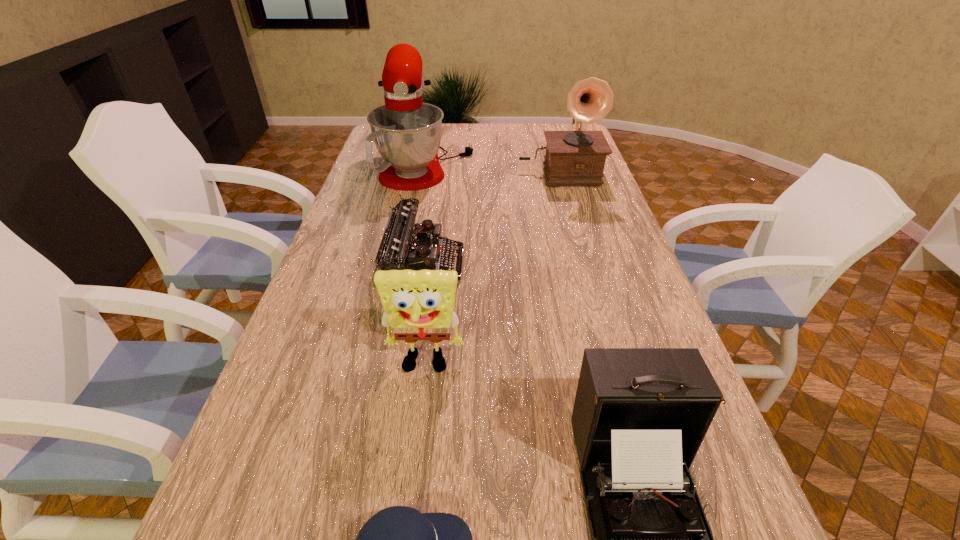
This screenshot has height=540, width=960. In order to click on object that is at the left edge in this screenshot , I will do `click(407, 133)`.

The height and width of the screenshot is (540, 960). Identify the location of object present at the right edge. (573, 158).

Identify the location of object that is at the far left corner. This screenshot has width=960, height=540. (407, 133).

In the image, there is a desktop. At what (x,y) coordinates should I click in order to perform the action: click on vacant space at the far edge. Please return your answer as a coordinate pair (x, y). This screenshot has height=540, width=960. Looking at the image, I should click on (488, 130).

Image resolution: width=960 pixels, height=540 pixels. I want to click on vacant space at the left edge of the desktop, so click(314, 485).

The height and width of the screenshot is (540, 960). In order to click on vacant region between the farther typewriter and the record player in this screenshot , I will do `click(492, 218)`.

Where is `object that is the nearest to the third nearest object`? The image size is (960, 540). object that is the nearest to the third nearest object is located at coordinates (402, 248).

Image resolution: width=960 pixels, height=540 pixels. What are the coordinates of `object that is the second closest to the baseball cap` in the screenshot? It's located at (418, 305).